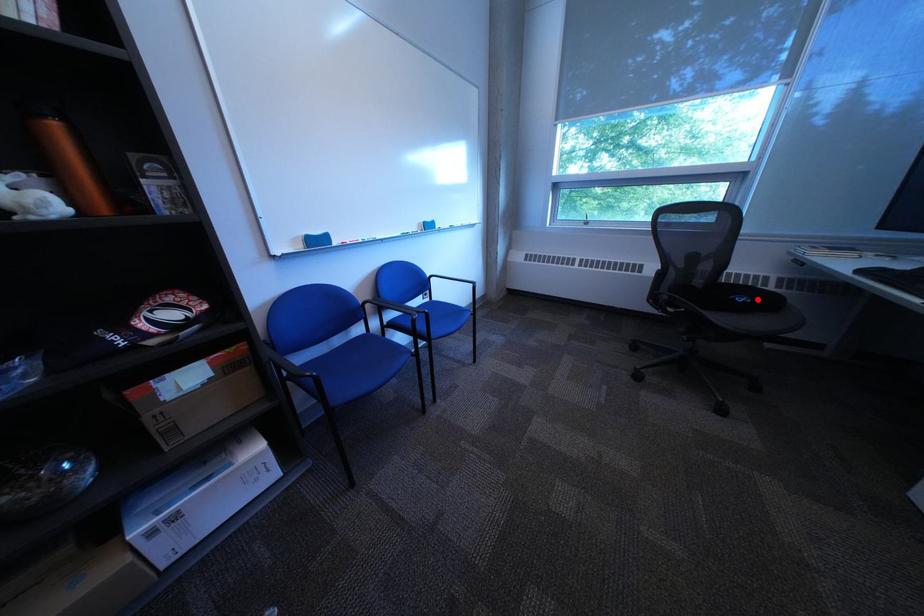
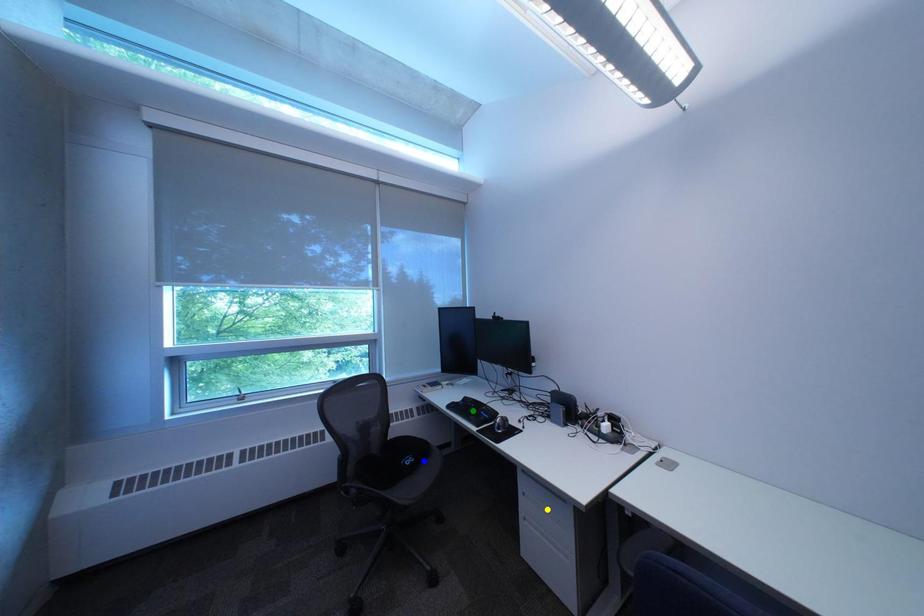
Question: I am providing you with two images of the same scene from different viewpoints. A red point is marked on the first image. You are given multiple points on the second image. Which mark in image 2 goes with the point in image 1?

Choices:
 (A) yellow point
 (B) green point
 (C) blue point

Answer: (C)